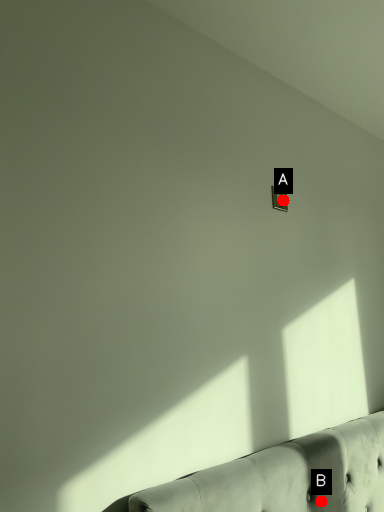
Question: Two points are circled on the image, labeled by A and B beside each circle. Which point is closer to the camera?

Choices:
 (A) A is closer
 (B) B is closer

Answer: (B)